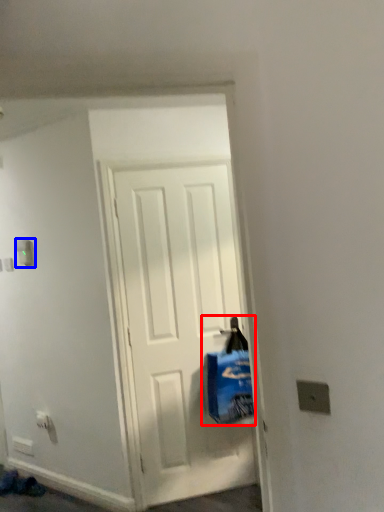
Question: Which object is closer to the camera taking this photo, shopping bag (highlighted by a red box) or light switch (highlighted by a blue box)?

Choices:
 (A) shopping bag
 (B) light switch

Answer: (A)